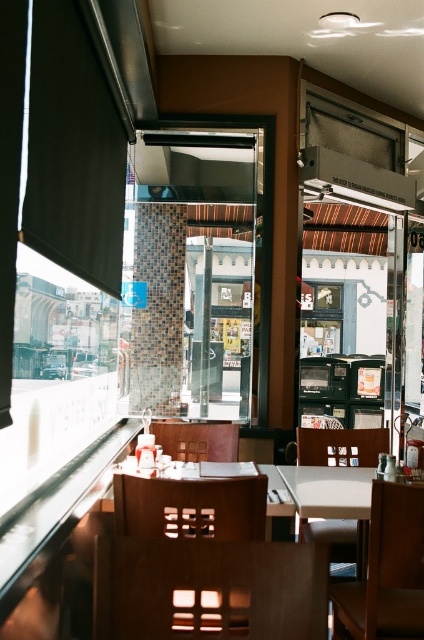
How distant is wooden chair at center from wooden table at center?

wooden chair at center and wooden table at center are 2.25 inches apart from each other.

Is wooden chair at center smaller than wooden table at center?

Yes.

Is point (161, 509) closer to camera compared to point (131, 492)?

Yes, it is in front of point (131, 492).

The width and height of the screenshot is (424, 640). Find the location of `wooden chair at center`. wooden chair at center is located at coordinates (190, 508).

Who is more forward, (379, 600) or (301, 518)?

Point (379, 600)

Is brown leather chair at lower right smaller than white plastic chair at center?

Incorrect, brown leather chair at lower right is not smaller in size than white plastic chair at center.

Is point (384, 536) more distant than point (337, 451)?

No.

Locate an element on the screen. brown leather chair at lower right is located at coordinates (387, 572).

Does wooden chair at center have a lesser height compared to white plastic chair at center?

In fact, wooden chair at center may be taller than white plastic chair at center.

Locate an element on the screen. The height and width of the screenshot is (640, 424). wooden chair at center is located at coordinates (190, 508).

Where is `wooden chair at center`? This screenshot has height=640, width=424. wooden chair at center is located at coordinates (190, 508).